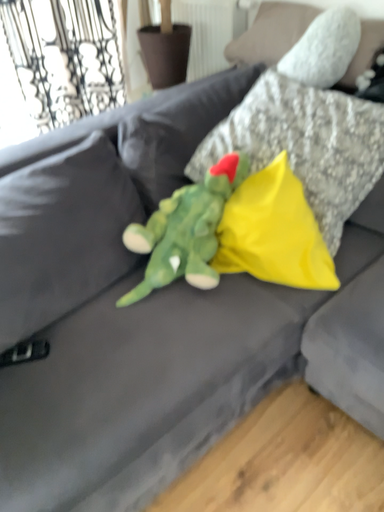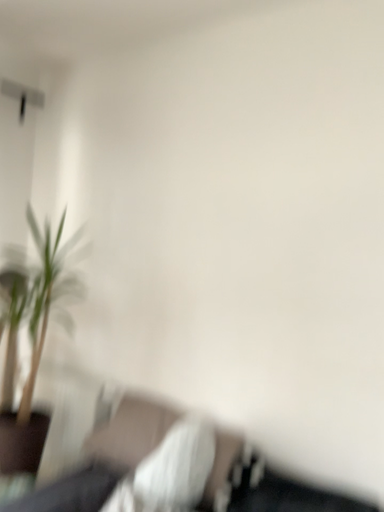
Question: How did the camera likely rotate when shooting the video?

Choices:
 (A) rotated left
 (B) rotated right

Answer: (B)